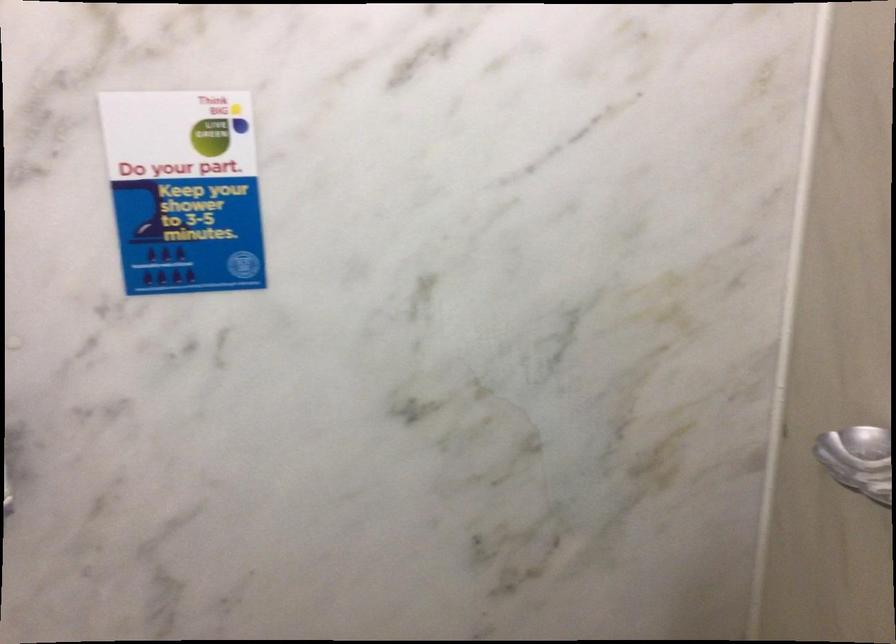
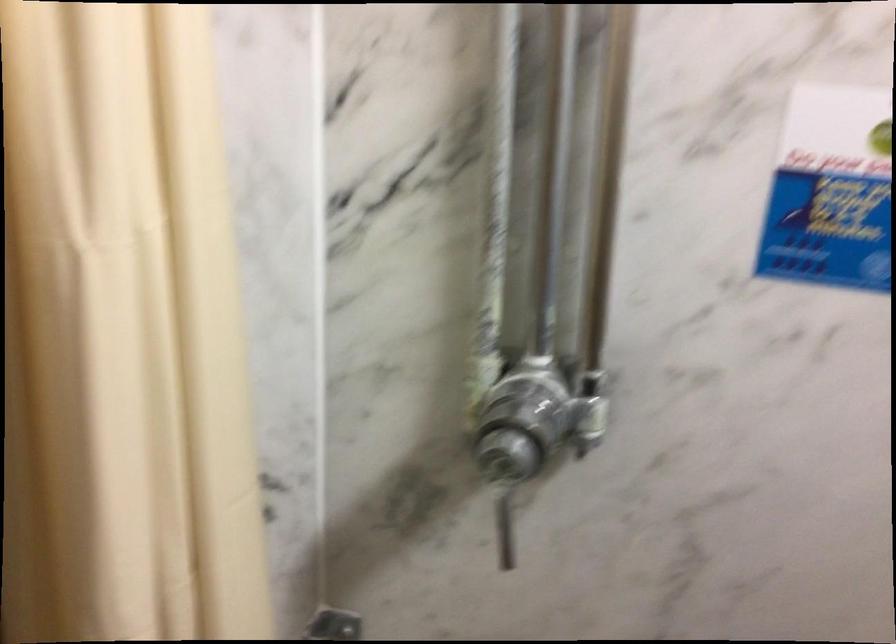
First-person continuous shooting, in which direction is the camera rotating?

The camera's rotation is toward right-down.